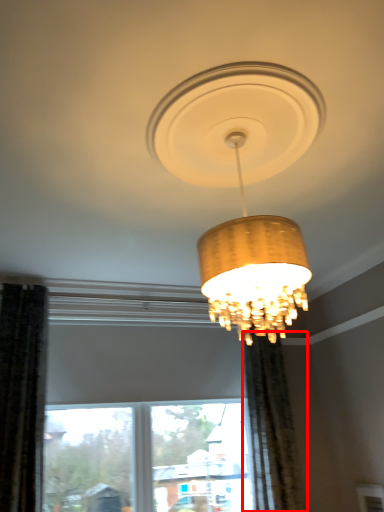
Question: From the image's perspective, considering the relative positions of curtain (annotated by the red box) and lamp in the image provided, where is curtain (annotated by the red box) located with respect to the staircase?

Choices:
 (A) above
 (B) below

Answer: (B)